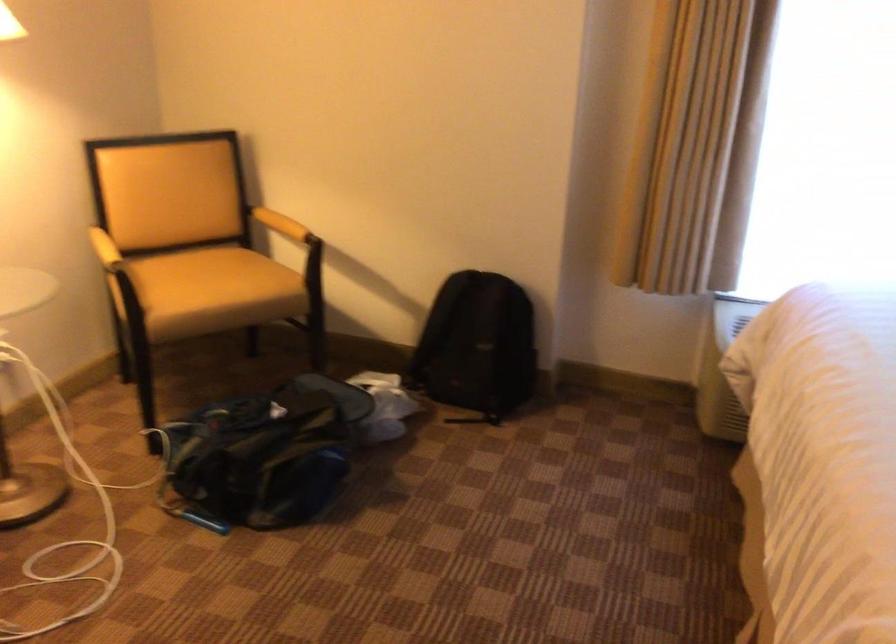
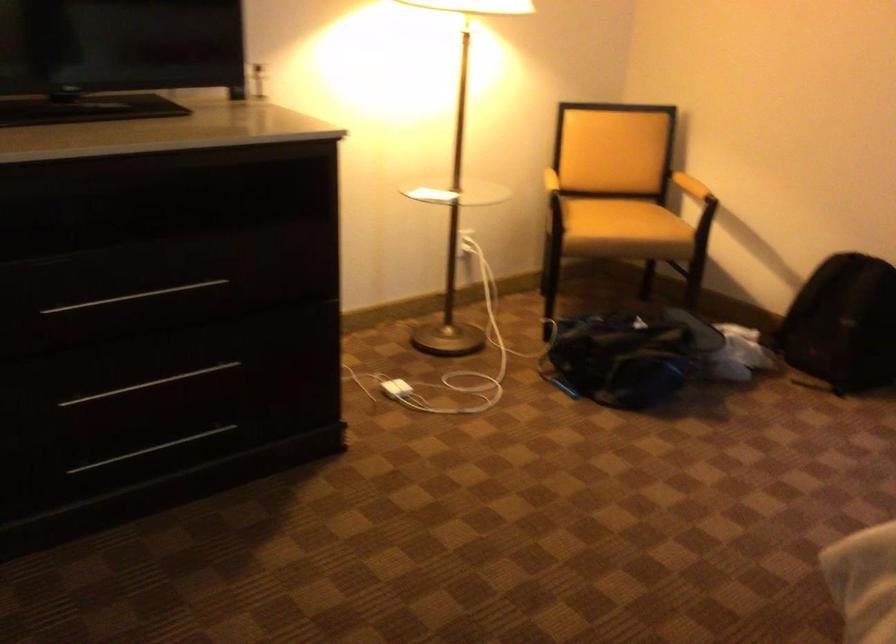
Locate, in the second image, the point that corresponds to [295,230] in the first image.

(690, 185)